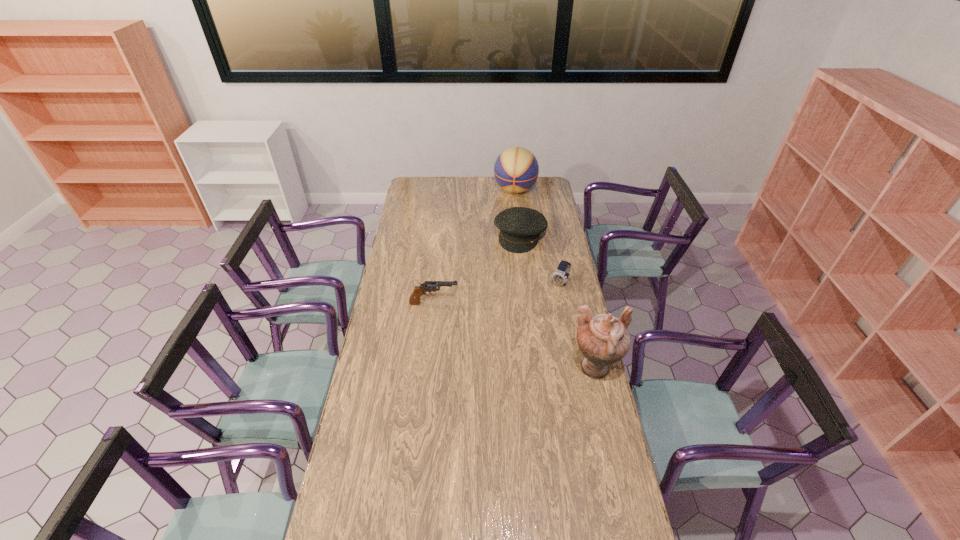
Find the location of a particular element. free space on the desktop that is between the gun and the urn and is positioned on the front-facing side of the second farthest object is located at coordinates (488, 326).

This screenshot has height=540, width=960. Find the location of `free spot on the desktop that is between the leftmost object and the nearest object and is positioned on the face of the watch`. free spot on the desktop that is between the leftmost object and the nearest object and is positioned on the face of the watch is located at coordinates (522, 339).

Image resolution: width=960 pixels, height=540 pixels. Identify the location of free space on the desktop that is between the leftmost object and the nearest object and is positioned on the patterned surface of the basketball. (490, 326).